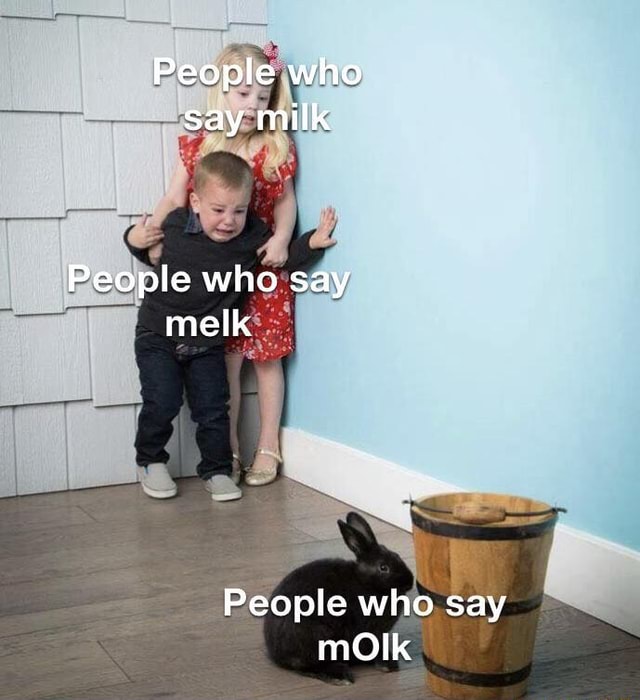
At what (x,y) coordinates should I click in order to perform the action: click on hardwood floor, grey-brown color. Please return your answer as a coordinate pair (x, y). The height and width of the screenshot is (700, 640). Looking at the image, I should click on (75, 575).